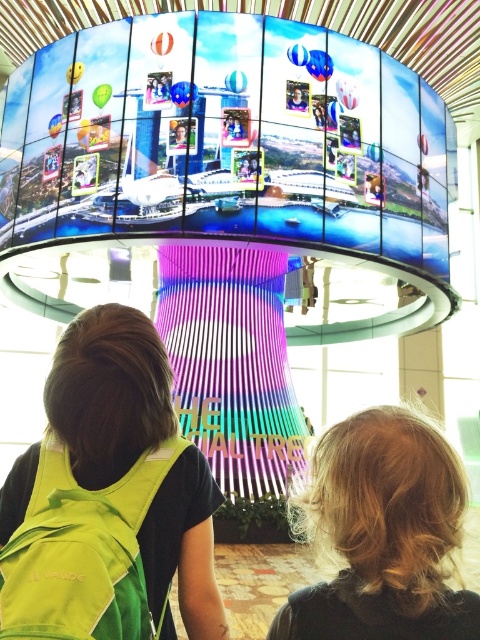
Is point (420, 449) farther from viewer compared to point (132, 579)?

No, it is not.

Can you confirm if blonde hair at upper right is smaller than green fabric safety vest at lower left?

Yes, blonde hair at upper right is smaller than green fabric safety vest at lower left.

Describe the element at coordinates (383, 532) in the screenshot. I see `blonde hair at upper right` at that location.

Where is `blonde hair at upper right`? blonde hair at upper right is located at coordinates (383, 532).